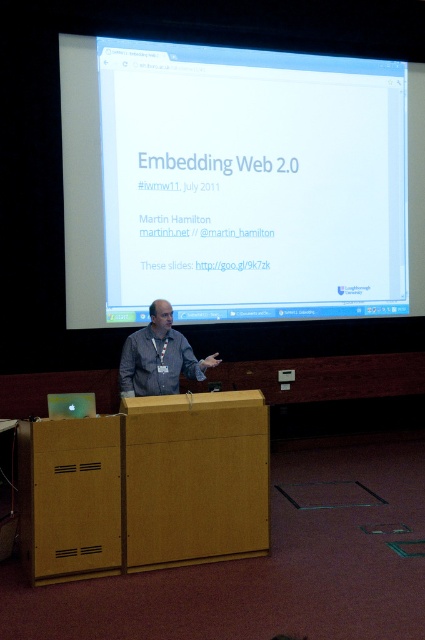
Can you confirm if white glossy projector screen at upper center is positioned to the left of gray fabric shirt at center?

No, white glossy projector screen at upper center is not to the left of gray fabric shirt at center.

Can you confirm if white glossy projector screen at upper center is taller than gray fabric shirt at center?

Indeed, white glossy projector screen at upper center has a greater height compared to gray fabric shirt at center.

This screenshot has width=425, height=640. In order to click on white glossy projector screen at upper center in this screenshot , I will do `click(238, 182)`.